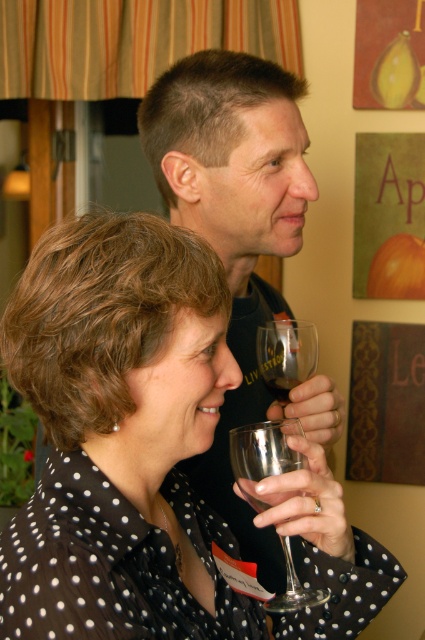
From the picture: You are a photographer aiming to capture a closeup shot of the clear glass wine glass at center. Given that your camera requires a minimum distance of 24 inches to focus properly, will you be able to take the photo without moving closer?

The clear glass wine glass at center is 25.93 inches away from the camera, which is more than the required 24 inches. Therefore, you can take the closeup shot without moving closer.

You are at point (183, 616) and want to walk to point (265, 476). Is there any obstacle between you and your destination?

Point (183, 616) is in front of point (265, 476), so there is no obstacle between them.

You are a photographer aiming to capture the clear glass wine glass at center without the black dotted shirt at center blocking it. What adjustment should you make to your camera angle?

The black dotted shirt at center is positioned over the clear glass wine glass at center, so to avoid the shirt blocking the glass, you should lower your camera angle to look up towards the glass.